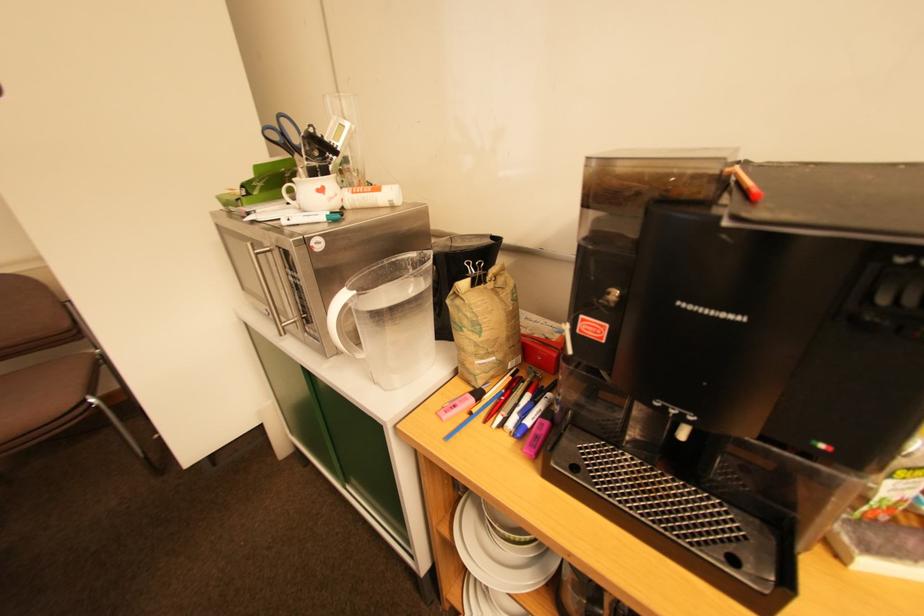
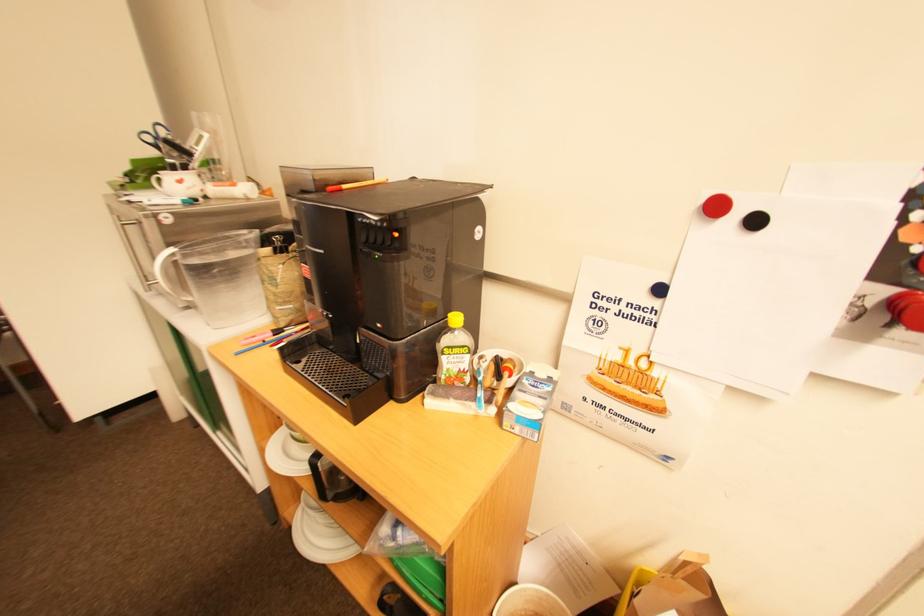
Question: How did the camera likely rotate?

Choices:
 (A) Left
 (B) Right
 (C) Up
 (D) Down

Answer: (B)